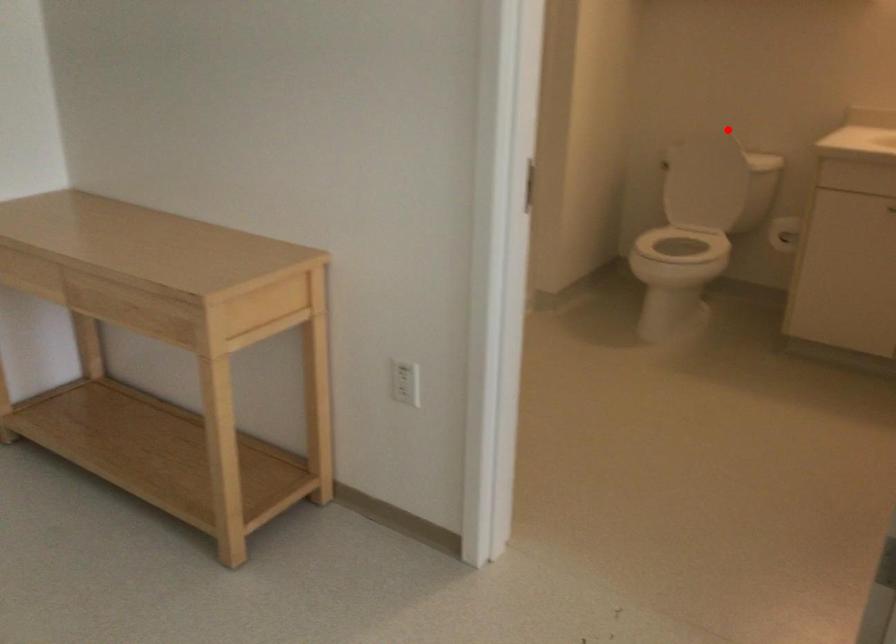
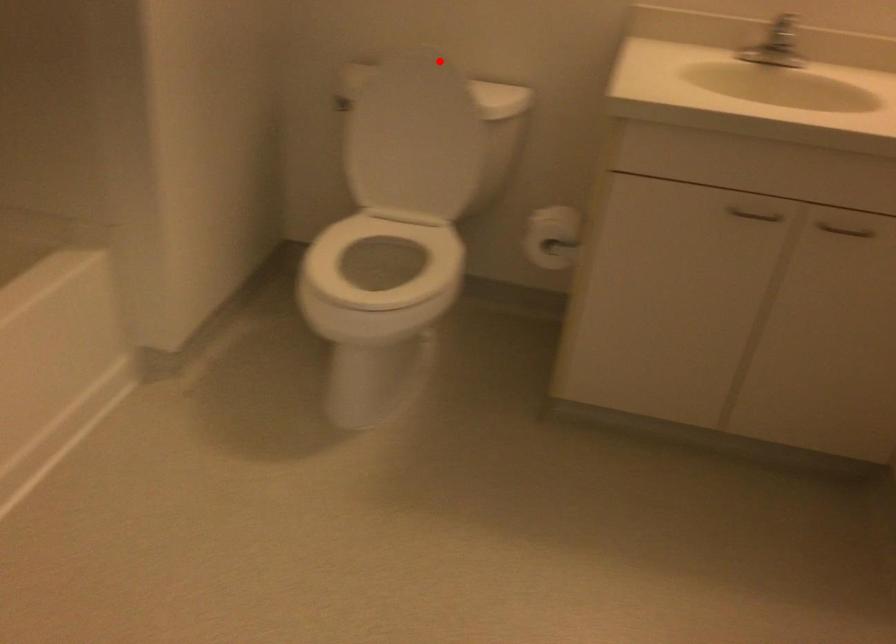
I am providing you with two images of the same scene from different viewpoints. A red point is marked on the first image and another point is marked on the second image. Does the point marked in image1 correspond to the same location as the one in image2?

Yes